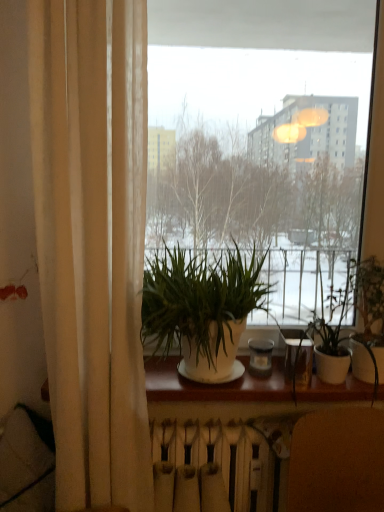
Question: Is green leafy plant at center, the first houseplant viewed from the right, facing away from brown leather armchair at lower right?

Choices:
 (A) yes
 (B) no

Answer: (B)

Question: Can you confirm if green leafy plant at center, which is the 2th houseplant in left-to-right order, is positioned to the right of brown leather armchair at lower right?

Choices:
 (A) no
 (B) yes

Answer: (B)

Question: Considering the relative positions of green leafy plant at center, the first houseplant viewed from the right, and brown leather armchair at lower right in the image provided, is green leafy plant at center, the first houseplant viewed from the right, behind brown leather armchair at lower right?

Choices:
 (A) yes
 (B) no

Answer: (A)

Question: From the image's perspective, is green leafy plant at center, which is the 2th houseplant in left-to-right order, beneath brown leather armchair at lower right?

Choices:
 (A) no
 (B) yes

Answer: (A)

Question: Is green leafy plant at center, which is the 2th houseplant in left-to-right order, smaller than brown leather armchair at lower right?

Choices:
 (A) yes
 (B) no

Answer: (A)

Question: Is point (251, 40) positioned closer to the camera than point (196, 430)?

Choices:
 (A) farther
 (B) closer

Answer: (A)

Question: From a real-world perspective, relative to white matte radiator at lower center, is transparent glass window at center vertically above or below?

Choices:
 (A) below
 (B) above

Answer: (B)

Question: Based on their positions, is transparent glass window at center located to the left or right of white matte radiator at lower center?

Choices:
 (A) right
 (B) left

Answer: (A)

Question: Based on their sizes in the image, would you say transparent glass window at center is bigger or smaller than white matte radiator at lower center?

Choices:
 (A) small
 (B) big

Answer: (B)

Question: In terms of width, does white matte wood at center look wider or thinner when compared to beige fabric curtain at left?

Choices:
 (A) wide
 (B) thin

Answer: (A)

Question: Is white matte wood at center in front of or behind beige fabric curtain at left in the image?

Choices:
 (A) behind
 (B) front

Answer: (A)

Question: Is point (226, 388) positioned closer to the camera than point (105, 51)?

Choices:
 (A) farther
 (B) closer

Answer: (A)

Question: From a real-world perspective, is white matte wood at center positioned above or below beige fabric curtain at left?

Choices:
 (A) below
 (B) above

Answer: (A)

Question: Is green leafy plant at center, the first houseplant viewed from the right, taller or shorter than white matte wood at center?

Choices:
 (A) short
 (B) tall

Answer: (B)

Question: Choose the correct answer: Is green leafy plant at center, the first houseplant viewed from the right, inside white matte wood at center or outside it?

Choices:
 (A) outside
 (B) inside

Answer: (A)